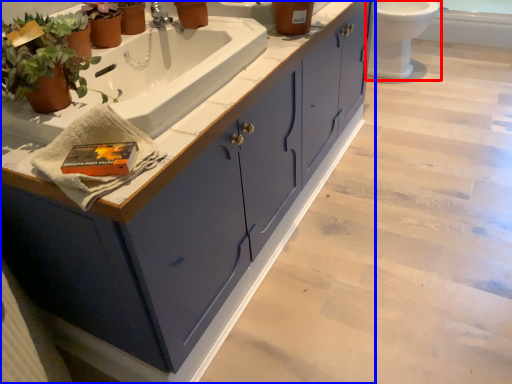
Question: Which point is closer to the camera, toilet (highlighted by a red box) or bathroom cabinet (highlighted by a blue box)?

Choices:
 (A) toilet
 (B) bathroom cabinet

Answer: (B)